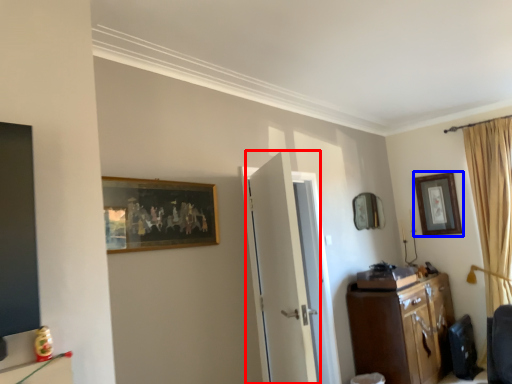
Question: Which point is further to the camera, door (highlighted by a red box) or picture frame (highlighted by a blue box)?

Choices:
 (A) door
 (B) picture frame

Answer: (B)